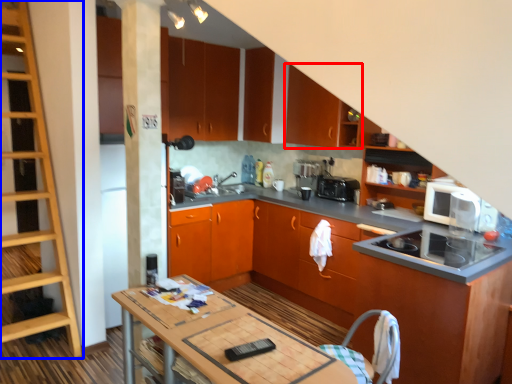
Question: Which object is further to the camera taking this photo, cabinetry (highlighted by a red box) or shelf (highlighted by a blue box)?

Choices:
 (A) cabinetry
 (B) shelf

Answer: (A)